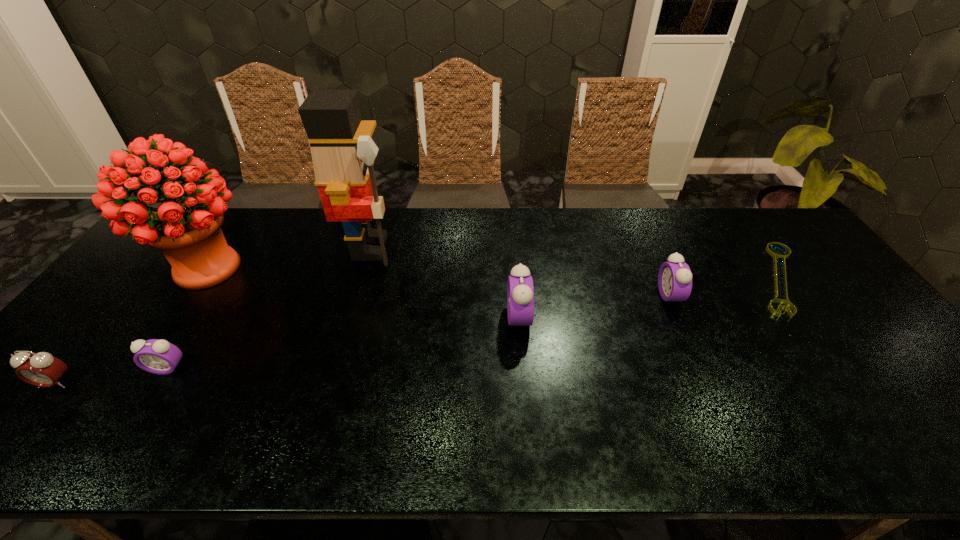
Where is `alarm clock that is the third closest one to the bouquet`? Image resolution: width=960 pixels, height=540 pixels. alarm clock that is the third closest one to the bouquet is located at coordinates (520, 291).

Identify the location of free spot that satisfies the following two spatial constraints: 1. in front of the fourth object from left to right holding the staff; 2. on the clock face of the nearest object. This screenshot has width=960, height=540. (331, 383).

Locate an element on the screen. free space that satisfies the following two spatial constraints: 1. on the face of the third object from right to left; 2. on the clock face of the leftmost alarm clock is located at coordinates 524,383.

Identify the location of blank area in the image that satisfies the following two spatial constraints: 1. on the front side of the shortest object; 2. on the face of the fifth object from left to right. The width and height of the screenshot is (960, 540). (807, 318).